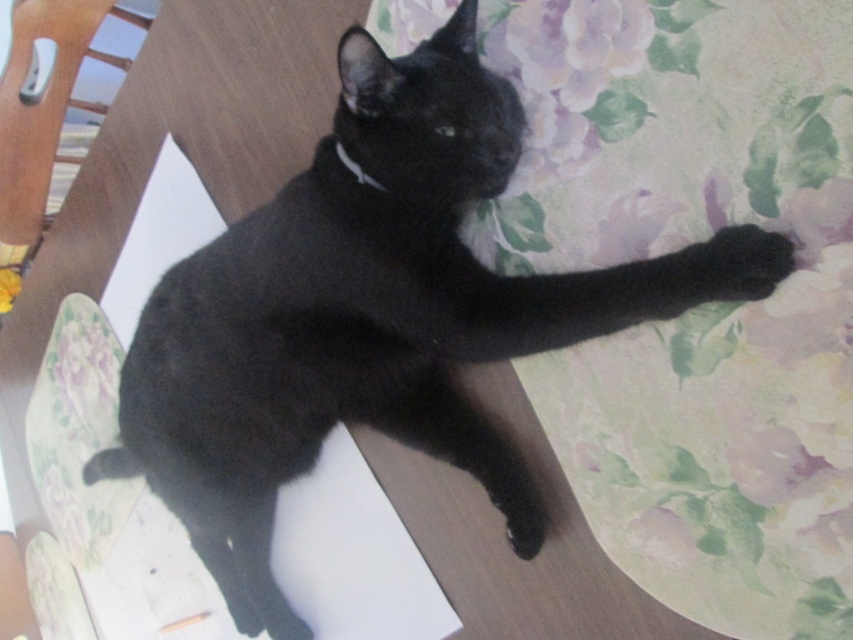
Question: Which object appears farthest from the camera in this image?

Choices:
 (A) black fuzzy paw at upper right
 (B) silvery metallic collar at upper center

Answer: (B)

Question: Where is black fuzzy paw at upper right located in relation to silvery metallic collar at upper center in the image?

Choices:
 (A) right
 (B) left

Answer: (A)

Question: From the image, what is the correct spatial relationship of black fuzzy paw at upper right in relation to silvery metallic collar at upper center?

Choices:
 (A) right
 (B) left

Answer: (A)

Question: Can you confirm if black fuzzy paw at upper right is positioned above silvery metallic collar at upper center?

Choices:
 (A) yes
 (B) no

Answer: (B)

Question: Which point is closer to the camera?

Choices:
 (A) (339, 147)
 (B) (750, 285)

Answer: (B)

Question: Which point is closer to the camera?

Choices:
 (A) (773, 234)
 (B) (376, 188)

Answer: (A)